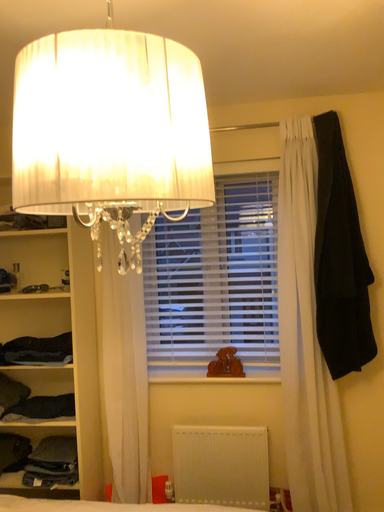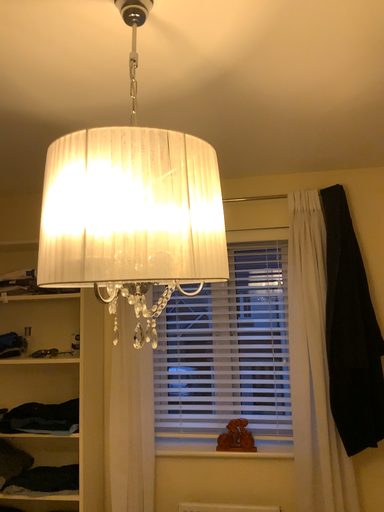
Question: Which way did the camera rotate in the video?

Choices:
 (A) rotated upward
 (B) rotated downward

Answer: (A)